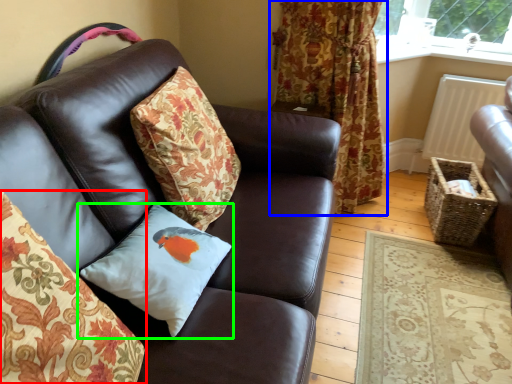
Question: Based on their relative distances, which object is nearer to pillow (highlighted by a red box)? Choose from curtain (highlighted by a blue box) and pillow (highlighted by a green box).

Choices:
 (A) curtain
 (B) pillow

Answer: (B)